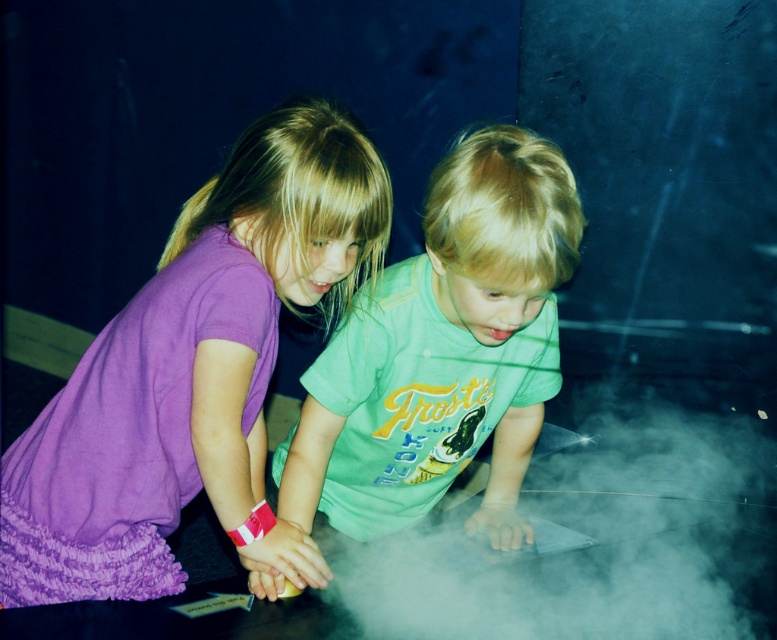
You are a photographer standing at the origin point of the coordinate system. The image has a coordinate system where the bottom left corner is the origin. The green matte shirt at center is at point A. The dry ice vapor is at point B. What is the direction from point A to point B?

The direction from point A to point B is northeast because the dry ice vapor is located northeast of the green matte shirt at center based on their coordinates.

You are a scientist observing the experiment. The green matte shirt at center and the white fog at center are both at the center of the image. Which one has a greater width?

The white fog at center has a greater width than the green matte shirt at center because the green matte shirt at center is narrower.

You are a photographer trying to capture the children and their experiment. You need to ensure both the purple fabric dress at left and the white fog at center are clearly visible in the photo. Given their sizes, which object should you focus on first to ensure sharpness?

The purple fabric dress at left is bigger than the white fog at center, so you should focus on the purple fabric dress at left first to ensure sharpness since larger objects require more precise focus to capture details clearly.